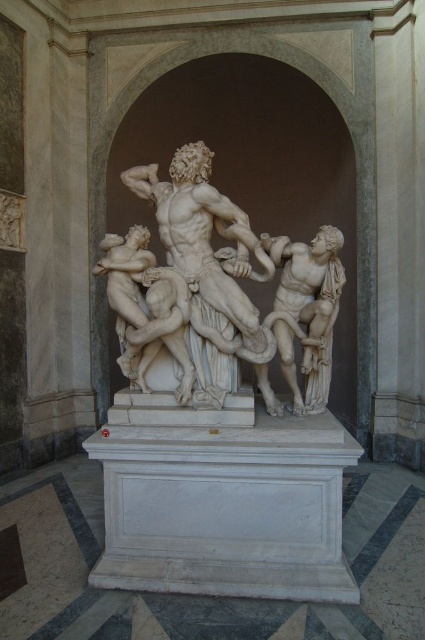
In the scene shown: You are standing in front of the sculpture and want to take a photo of it. Your camera has a maximum focus range of 10 feet. Will the white marble sculpture at center be in focus?

The white marble sculpture at center is 9.39 feet away from the viewer, which is within the camera maximum focus range of 10 feet. Therefore, the sculpture will be in focus.